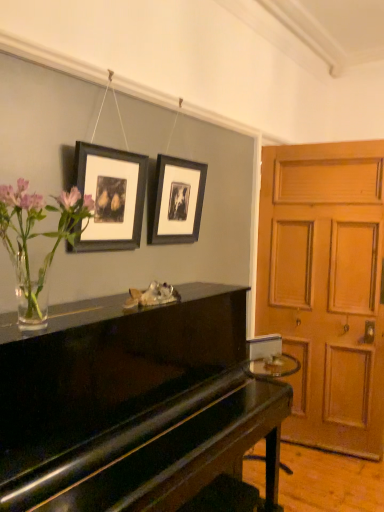
Where is `free area below black matte picture frame at upper center, the 2th picture frame when ordered from front to back (from a real-world perspective)`? free area below black matte picture frame at upper center, the 2th picture frame when ordered from front to back (from a real-world perspective) is located at coordinates (182, 284).